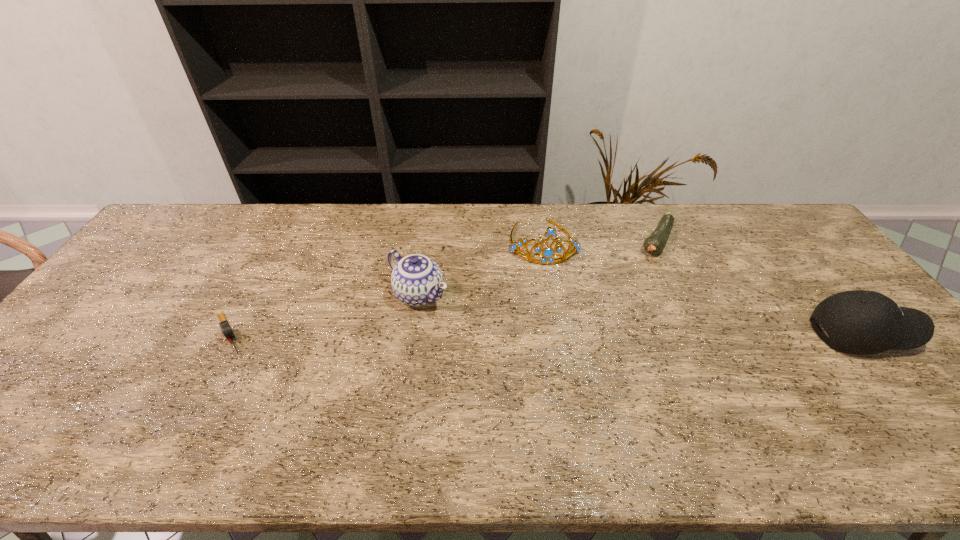
This screenshot has height=540, width=960. What are the coordinates of `vacant space located 0.130m at the spout of the fourth object from right to left` in the screenshot? It's located at (475, 334).

Identify the location of vacant area located 0.200m at the blossom end of the zucchini. The height and width of the screenshot is (540, 960). (628, 295).

The image size is (960, 540). In order to click on vacant space located 0.100m at the blossom end of the zucchini in this screenshot , I will do `click(641, 276)`.

This screenshot has width=960, height=540. I want to click on vacant region located at the blossom end of the zucchini, so click(619, 307).

Where is `free spot located on the front-facing side of the third object from right to left`? This screenshot has height=540, width=960. free spot located on the front-facing side of the third object from right to left is located at coordinates (552, 296).

At what (x,y) coordinates should I click in order to perform the action: click on vacant area situated on the front-facing side of the third object from right to left. Please return your answer as a coordinate pair (x, y). The height and width of the screenshot is (540, 960). Looking at the image, I should click on (553, 304).

The image size is (960, 540). I want to click on free region located on the front-facing side of the third object from right to left, so click(x=554, y=309).

Where is `zucchini present at the far edge`? This screenshot has width=960, height=540. zucchini present at the far edge is located at coordinates (656, 241).

Identify the location of tiara that is positioned at the far edge. The image size is (960, 540). (547, 255).

Identify the location of object present at the right edge. (859, 322).